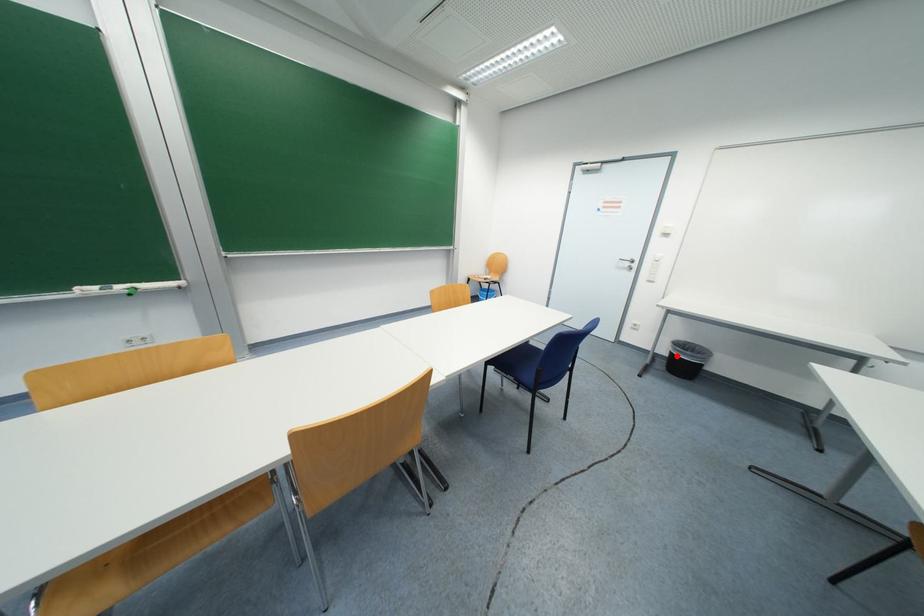
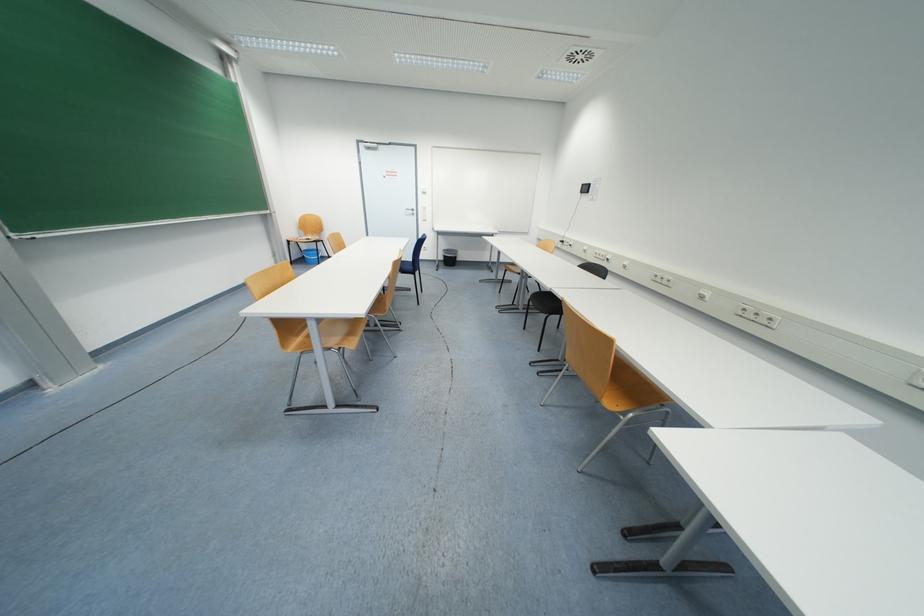
Question: I am providing you with two images of the same scene from different viewpoints. Image1 has a red point marked. In image2, the corresponding 3D location appears at what relative position? Reply with the corresponding letter.

Choices:
 (A) Closer
 (B) Farther

Answer: (A)